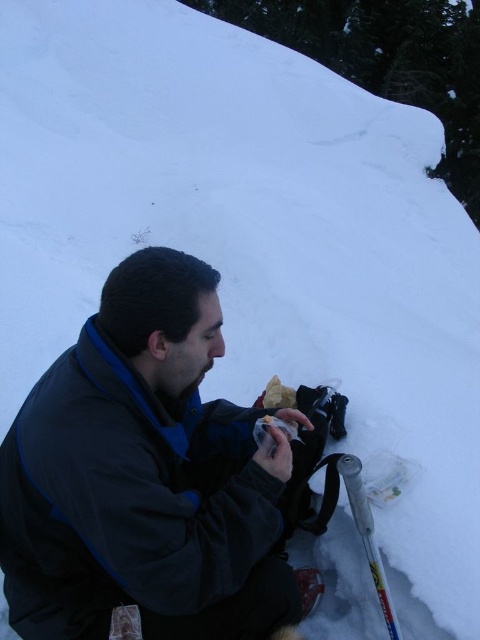
Question: Is dark blue fleece jacket at center smaller than silver metallic ski pole at lower right?

Choices:
 (A) yes
 (B) no

Answer: (B)

Question: Can you confirm if dark blue fleece jacket at center is wider than silver metallic ski pole at lower right?

Choices:
 (A) no
 (B) yes

Answer: (B)

Question: From the image, what is the correct spatial relationship of dark blue fleece jacket at center in relation to silver metallic ski pole at lower right?

Choices:
 (A) right
 (B) left

Answer: (B)

Question: Among these objects, which one is farthest from the camera?

Choices:
 (A) silver metallic ski pole at lower right
 (B) dark blue fleece jacket at center

Answer: (A)